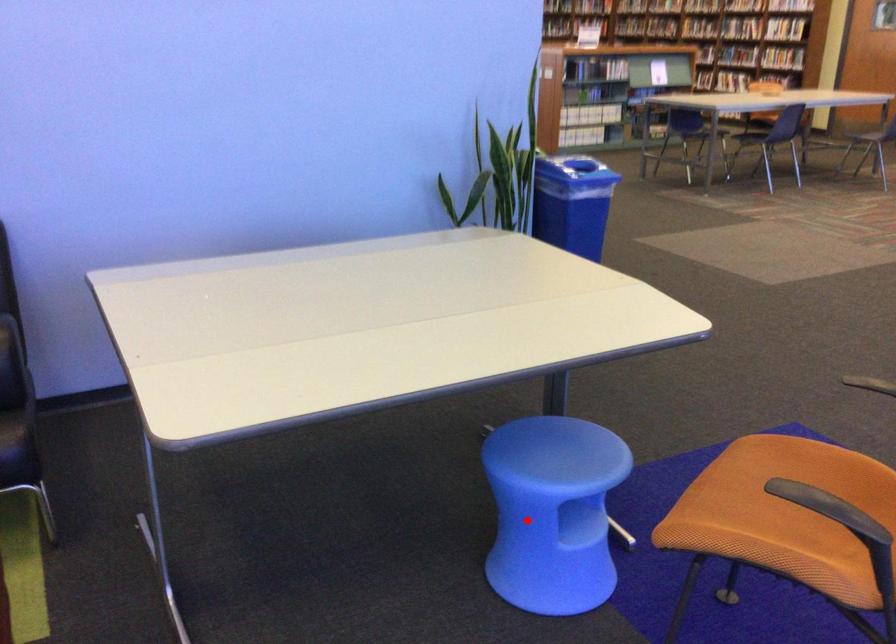
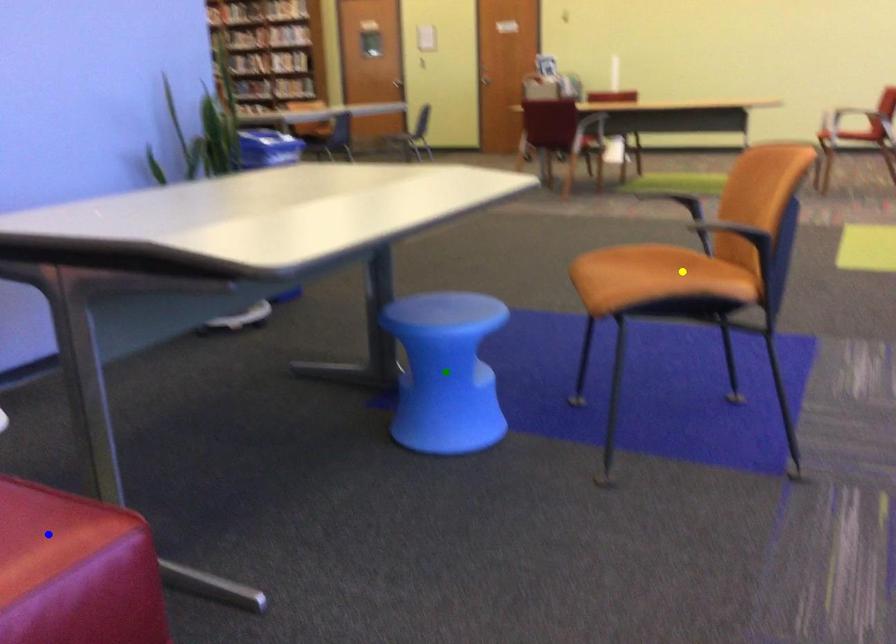
Question: I am providing you with two images of the same scene from different viewpoints. A red point is marked on the first image. You are given multiple points on the second image. In image 2, which mark is for the same physical point as the one in image 1?

Choices:
 (A) green point
 (B) blue point
 (C) yellow point

Answer: (A)